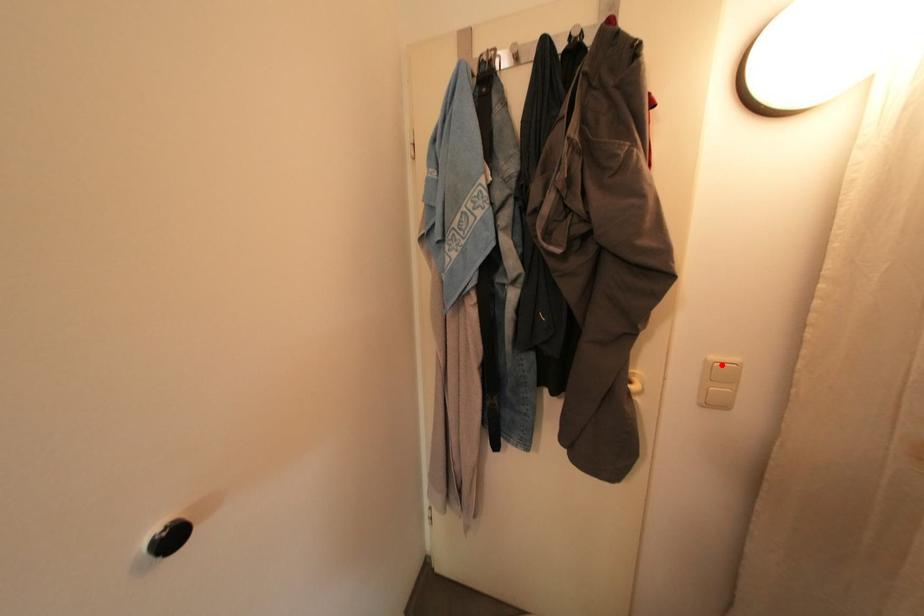
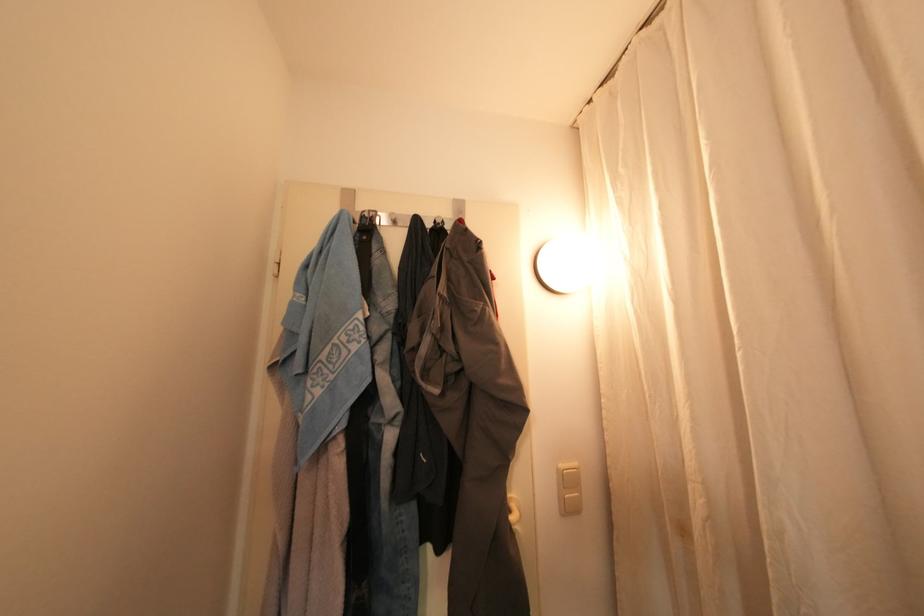
Where in the second image is the point corresponding to the highlighted location from the first image?

(568, 474)